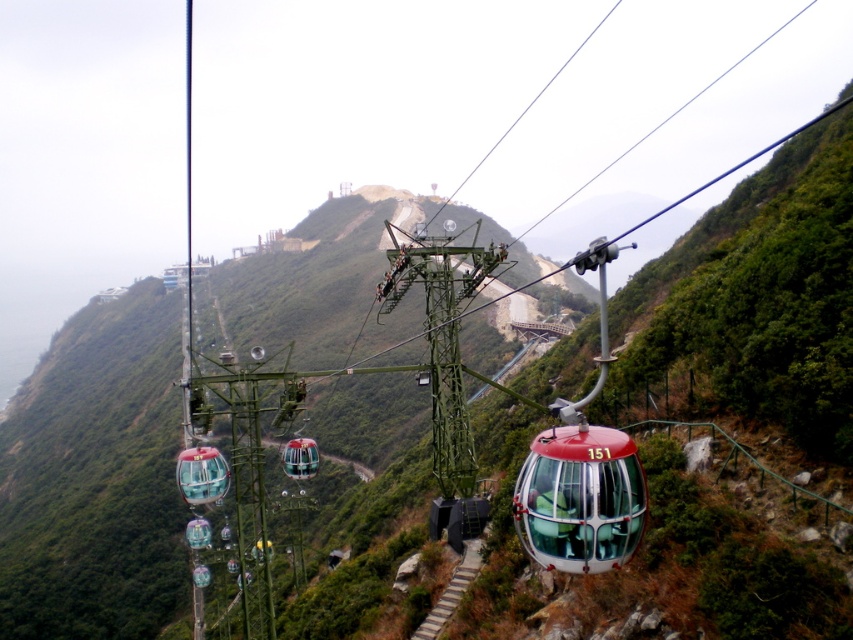
Is metallic glass cable car at center shorter than transparent glass cable car at center?

No.

Can you confirm if metallic glass cable car at center is positioned to the right of transparent glass cable car at center?

Indeed, metallic glass cable car at center is positioned on the right side of transparent glass cable car at center.

Between point (567, 472) and point (291, 476), which one is positioned in front?

Point (567, 472) is in front.

The height and width of the screenshot is (640, 853). In order to click on metallic glass cable car at center in this screenshot , I will do `click(579, 499)`.